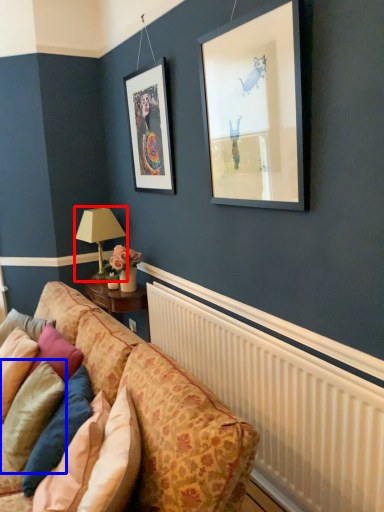
Question: Which object is closer to the camera taking this photo, table lamp (highlighted by a red box) or pillow (highlighted by a blue box)?

Choices:
 (A) table lamp
 (B) pillow

Answer: (B)